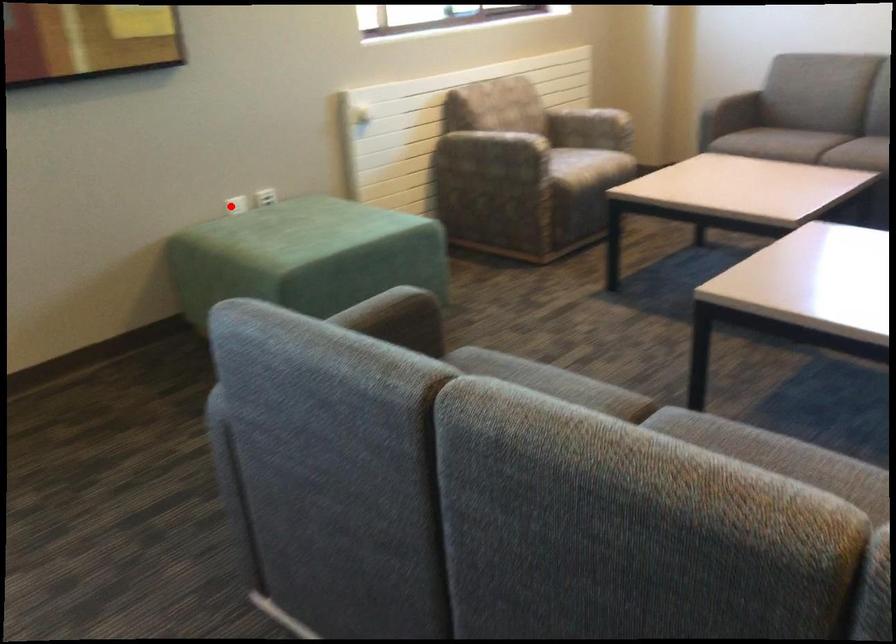
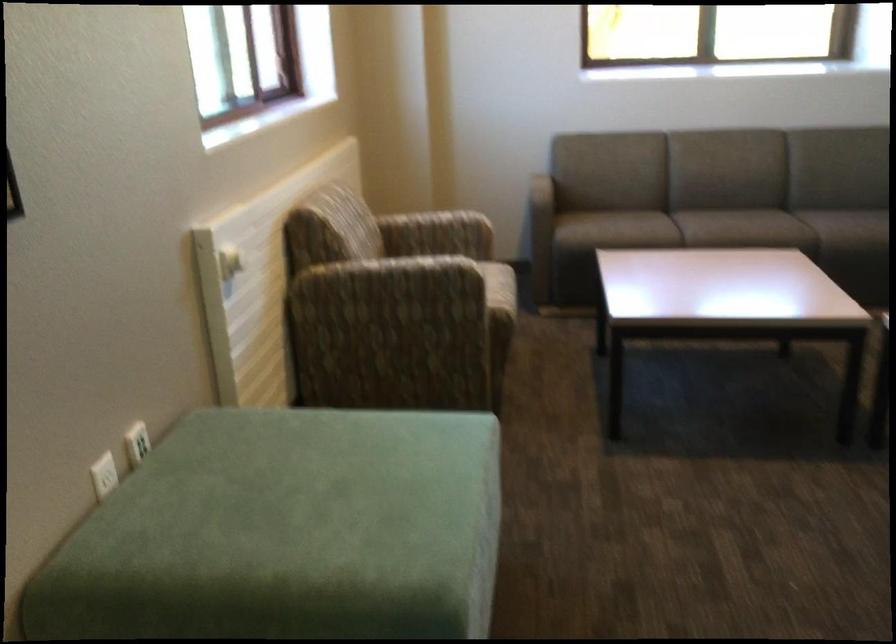
Question: I am providing you with two images of the same scene from different viewpoints. Image1 has a red point marked. In image2, the corresponding 3D location appears at what relative position? Reply with the corresponding letter.

Choices:
 (A) Closer
 (B) Farther

Answer: (A)